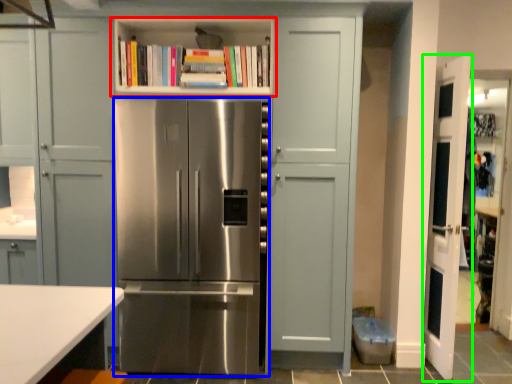
Question: Estimate the real-world distances between objects in this image. Which object is farther from shelf (highlighted by a red box), refrigerator (highlighted by a blue box) or door (highlighted by a green box)?

Choices:
 (A) refrigerator
 (B) door

Answer: (B)